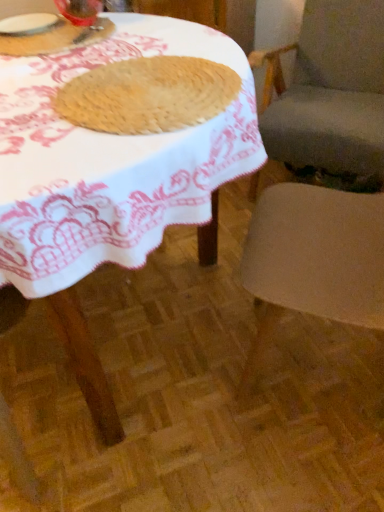
This screenshot has width=384, height=512. Find the location of `free point below smooth beige chair at right, arranged as the 1th chair when viewed from the front (from a real-world perspective)`. free point below smooth beige chair at right, arranged as the 1th chair when viewed from the front (from a real-world perspective) is located at coordinates (315, 362).